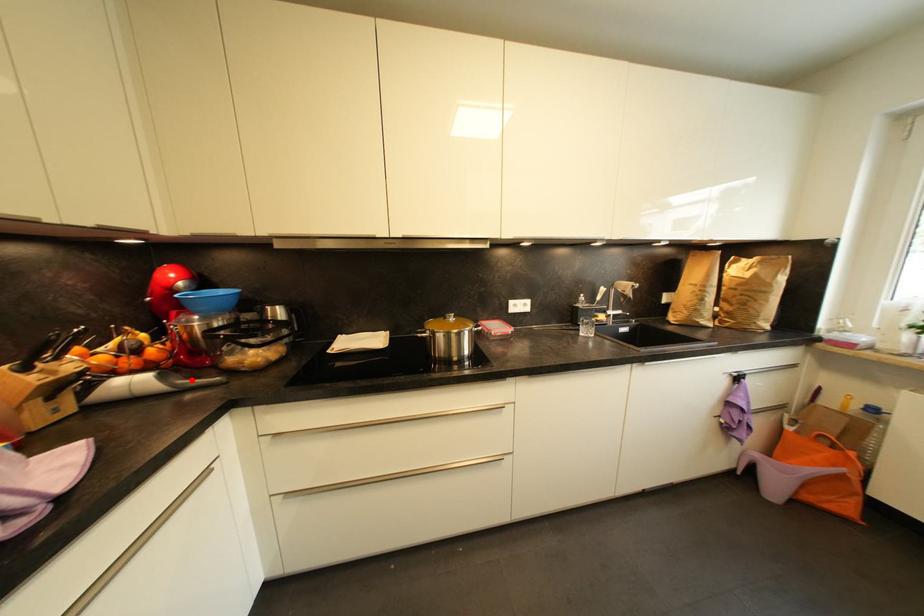
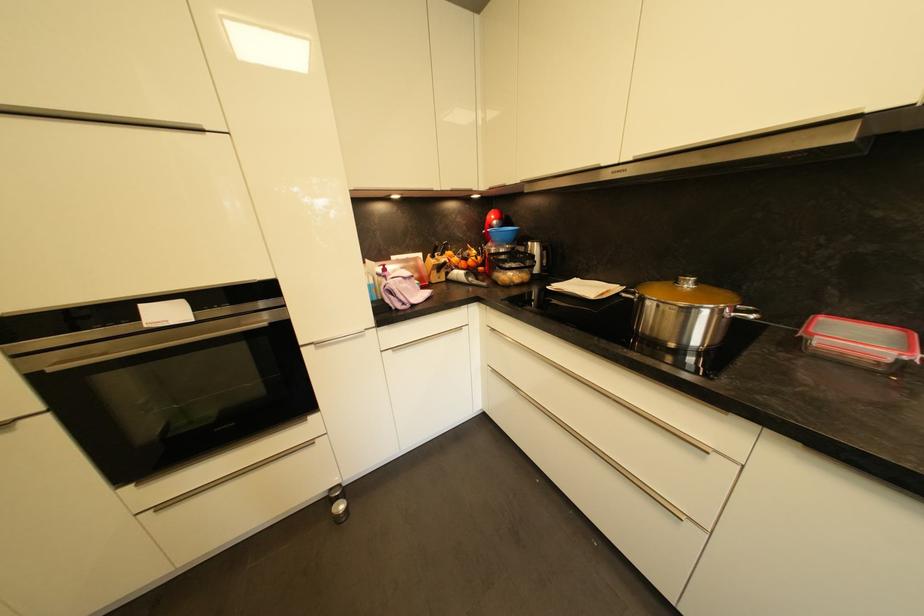
Where in the second image is the point corresponding to the highlighted location from the first image?

(481, 281)